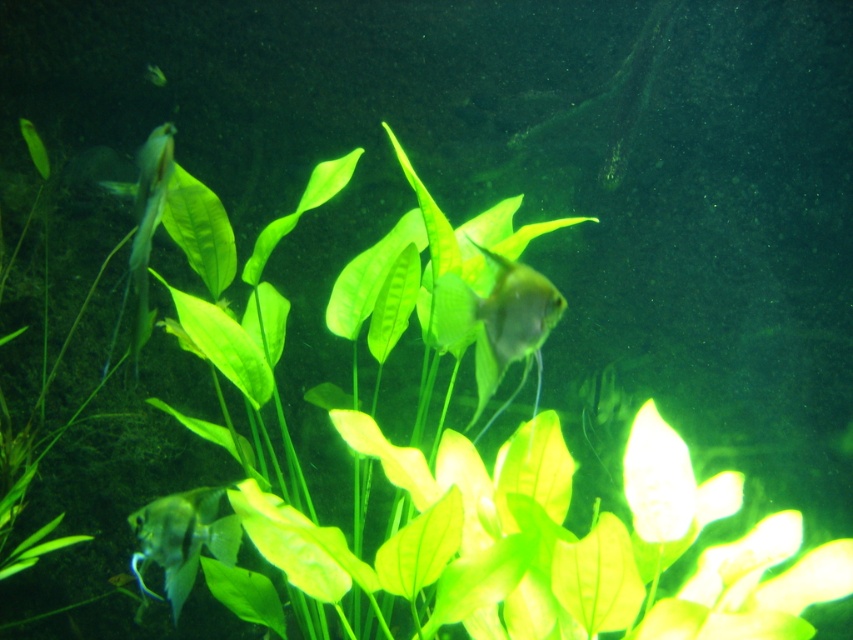
You are an underwater explorer observing the scene. You notice a transparent glass fish at center. Can you determine its exact 2D coordinates in the image?

The transparent glass fish at center is located at the 2D coordinates of point (497, 321).

You are a marine biologist observing an underwater scene in an aquarium. You notice two fish species here, the translucent silver fish at lower left and the translucent white fish at left. Which of these two fish is smaller in size?

The translucent silver fish at lower left is smaller in size compared to the translucent white fish at left.